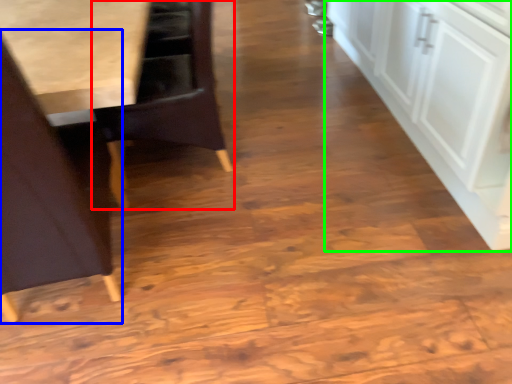
Question: Based on their relative distances, which object is nearer to chair (highlighted by a red box)? Choose from chair (highlighted by a blue box) and cabinetry (highlighted by a green box).

Choices:
 (A) chair
 (B) cabinetry

Answer: (A)